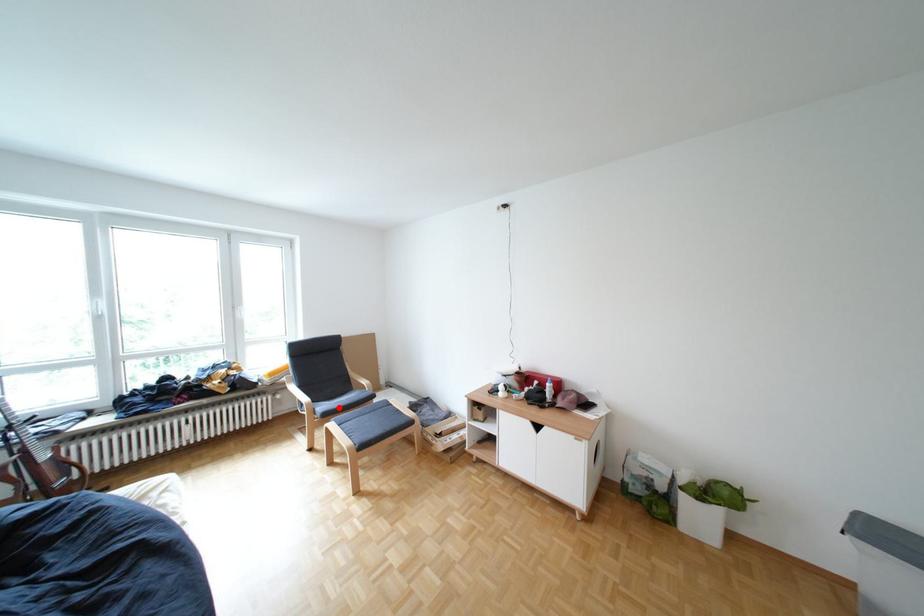
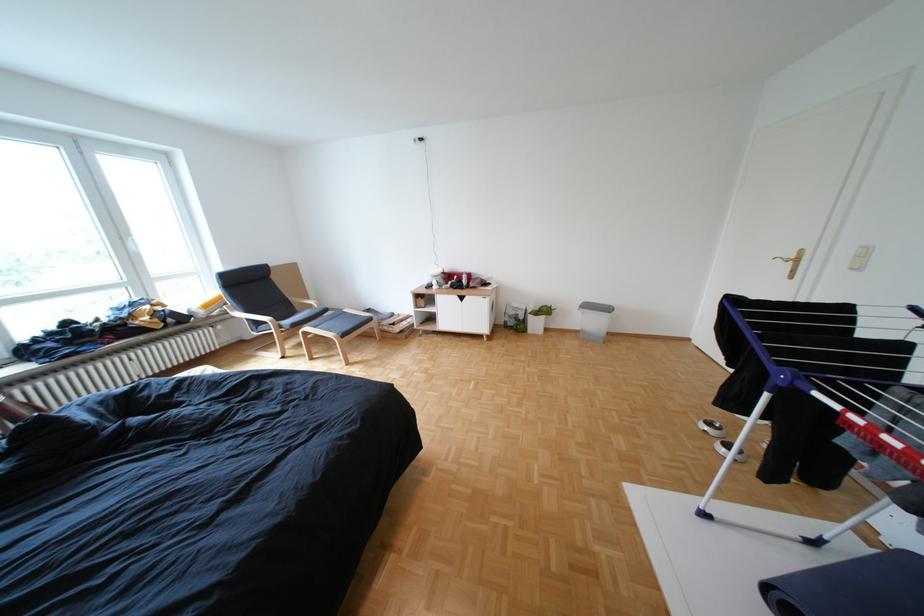
Find the pixel in the second image that matches the highlighted location in the first image.

(301, 323)